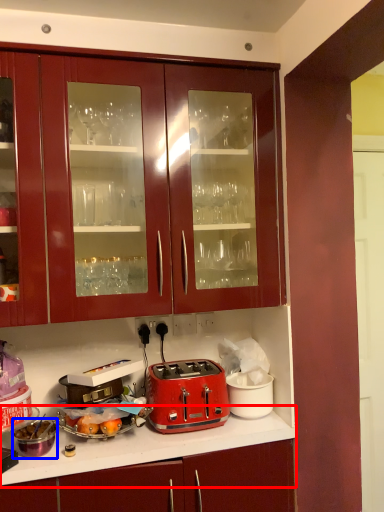
Question: Which of the following is the farthest to the observer, countertop (highlighted by a red box) or appliance (highlighted by a blue box)?

Choices:
 (A) countertop
 (B) appliance

Answer: (B)